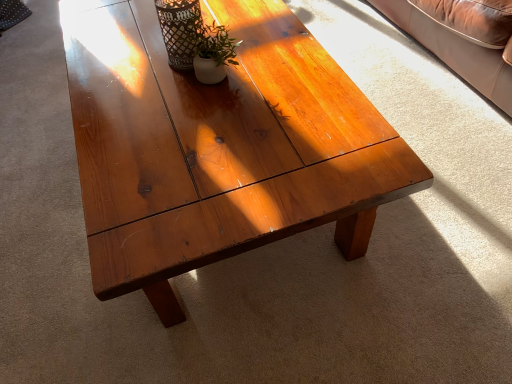
The height and width of the screenshot is (384, 512). What do you see at coordinates (219, 147) in the screenshot? I see `satin wood coffee table at center` at bounding box center [219, 147].

This screenshot has height=384, width=512. What are the coordinates of `matte black vase at upper center` in the screenshot? It's located at (178, 30).

At what (x,y) coordinates should I click in order to perform the action: click on satin wood coffee table at center. Please return your answer as a coordinate pair (x, y). This screenshot has width=512, height=384. Looking at the image, I should click on (219, 147).

Is matte black vase at upper center wider or thinner than satin wood coffee table at center?

matte black vase at upper center is thinner than satin wood coffee table at center.

Could you tell me if matte black vase at upper center is facing satin wood coffee table at center?

No, matte black vase at upper center is not facing towards satin wood coffee table at center.

From the image's perspective, which one is positioned higher, matte black vase at upper center or satin wood coffee table at center?

satin wood coffee table at center appears higher in the image.

Considering the sizes of objects matte white vase at center and matte black vase at upper center in the image provided, who is wider, matte white vase at center or matte black vase at upper center?

matte black vase at upper center is wider.

Which is in front, matte white vase at center or matte black vase at upper center?

Positioned in front is matte white vase at center.

How many degrees apart are the facing directions of matte white vase at center and matte black vase at upper center?

There is a 180-degree angle between the facing directions of matte white vase at center and matte black vase at upper center.

Is matte white vase at center located outside matte black vase at upper center?

matte white vase at center lies outside matte black vase at upper center's area.

Looking at this image, can you confirm if matte black vase at upper center is wider than matte white vase at center?

Correct, the width of matte black vase at upper center exceeds that of matte white vase at center.

Does matte black vase at upper center turn towards matte white vase at center?

No, matte black vase at upper center does not turn towards matte white vase at center.

In the scene shown: Is matte black vase at upper center not close to matte white vase at center?

No, there isn't a large distance between matte black vase at upper center and matte white vase at center.

Is matte white vase at center at the left side of satin wood coffee table at center?

No.

Is matte white vase at center positioned far away from satin wood coffee table at center?

No, there isn't a large distance between matte white vase at center and satin wood coffee table at center.

Measure the distance from matte white vase at center to satin wood coffee table at center.

They are 11.32 inches apart.

What are the coordinates of `houseplant behind the satin wood coffee table at center` in the screenshot? It's located at (210, 49).

Is satin wood coffee table at center oriented towards matte white vase at center?

No.

How distant is satin wood coffee table at center from matte white vase at center?

satin wood coffee table at center is 11.32 inches away from matte white vase at center.

Where is `houseplant above the satin wood coffee table at center (from a real-world perspective)`? This screenshot has width=512, height=384. houseplant above the satin wood coffee table at center (from a real-world perspective) is located at coordinates pos(210,49).

Does satin wood coffee table at center have a lesser height compared to matte white vase at center?

Yes.

Can matte black vase at upper center be found inside satin wood coffee table at center?

No, matte black vase at upper center is located outside of satin wood coffee table at center.

From a real-world perspective, relative to matte black vase at upper center, is satin wood coffee table at center vertically above or below?

In terms of real-world spatial position, satin wood coffee table at center is below matte black vase at upper center.

How different are the orientations of satin wood coffee table at center and matte black vase at upper center in degrees?

The angular difference between satin wood coffee table at center and matte black vase at upper center is 177 degrees.

Does satin wood coffee table at center come in front of matte black vase at upper center?

That is True.

Where is `coffee table directly beneath the matte black vase at upper center (from a real-world perspective)`? coffee table directly beneath the matte black vase at upper center (from a real-world perspective) is located at coordinates (219, 147).

Locate an element on the screen. The height and width of the screenshot is (384, 512). glass vase above the matte white vase at center (from the image's perspective) is located at coordinates (178, 30).

Which object lies further to the anchor point matte black vase at upper center, matte white vase at center or satin wood coffee table at center?

Based on the image, satin wood coffee table at center appears to be further to matte black vase at upper center.

From the picture: Considering their positions, is satin wood coffee table at center positioned further to matte white vase at center than matte black vase at upper center?

satin wood coffee table at center.

From the image, which object appears to be nearer to satin wood coffee table at center, matte white vase at center or matte black vase at upper center?

The object closer to satin wood coffee table at center is matte white vase at center.

Looking at the image, which one is located closer to satin wood coffee table at center, matte black vase at upper center or matte white vase at center?

matte white vase at center is closer to satin wood coffee table at center.

From the picture: Considering their positions, is satin wood coffee table at center positioned further to matte black vase at upper center than matte white vase at center?

satin wood coffee table at center.

From the image, which object appears to be farther from matte white vase at center, matte black vase at upper center or satin wood coffee table at center?

satin wood coffee table at center is further to matte white vase at center.

Locate an element on the screen. The image size is (512, 384). houseplant positioned between satin wood coffee table at center and matte black vase at upper center from near to far is located at coordinates (210, 49).